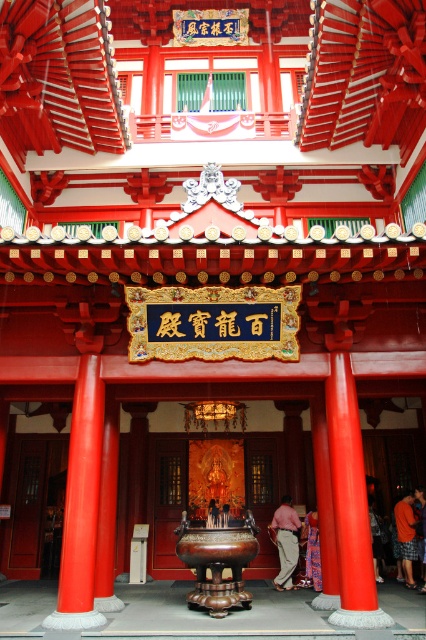
Question: Which point is closer to the camera taking this photo?

Choices:
 (A) (298, 515)
 (B) (377, 576)
 (C) (408, 541)
 (D) (307, 550)

Answer: (C)

Question: Can you confirm if silky purple robe at center is positioned below matte red person at center?

Choices:
 (A) yes
 (B) no

Answer: (A)

Question: Can you confirm if pink fabric pants at center is positioned to the left of matte red person at center?

Choices:
 (A) no
 (B) yes

Answer: (B)

Question: Which of the following is the closest to the observer?

Choices:
 (A) silky purple robe at center
 (B) orange cotton shorts at lower right
 (C) pink fabric pants at center

Answer: (A)

Question: Does pink fabric pants at center appear on the left side of matte red person at center?

Choices:
 (A) no
 (B) yes

Answer: (B)

Question: Which object appears closest to the camera in this image?

Choices:
 (A) orange fabric pants at center
 (B) pink fabric pants at center
 (C) silky purple robe at center
 (D) matte red person at center

Answer: (C)